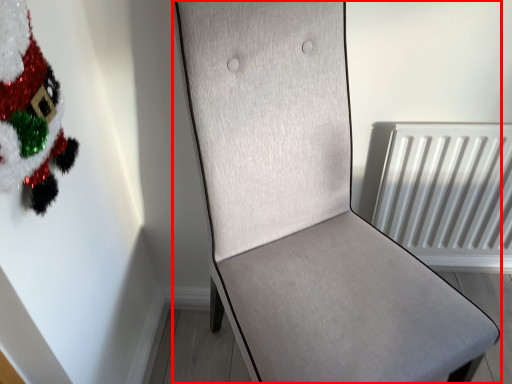
Question: Where is furniture (annotated by the red box) located in relation to christmas tree in the image?

Choices:
 (A) left
 (B) right

Answer: (B)